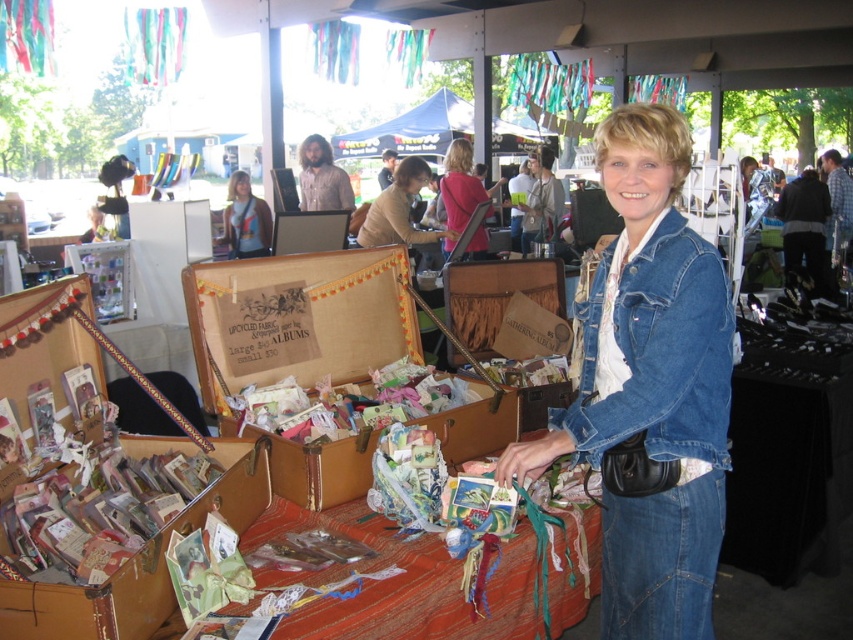
Question: Which is nearer to the blue fabric canopy at upper center?

Choices:
 (A) textured fabric table at center
 (B) brown leather suitcase at center

Answer: (B)

Question: Estimate the real-world distances between objects in this image. Which object is farther from the denim jacket at center?

Choices:
 (A) textured fabric table at center
 (B) light brown leather jacket at center
 (C) pink fabric at center
 (D) blue fabric canopy at upper center

Answer: (D)

Question: Which of the following is the closest to the observer?

Choices:
 (A) blue fabric canopy at upper center
 (B) textured fabric table at center

Answer: (B)

Question: Does textured fabric table at center appear on the right side of light brown leather jacket at center?

Choices:
 (A) no
 (B) yes

Answer: (B)

Question: Does brown leather suitcase at center have a smaller size compared to blue fabric canopy at upper center?

Choices:
 (A) no
 (B) yes

Answer: (B)

Question: Can you confirm if denim jacket at center is bigger than light brown leather jacket at center?

Choices:
 (A) yes
 (B) no

Answer: (B)